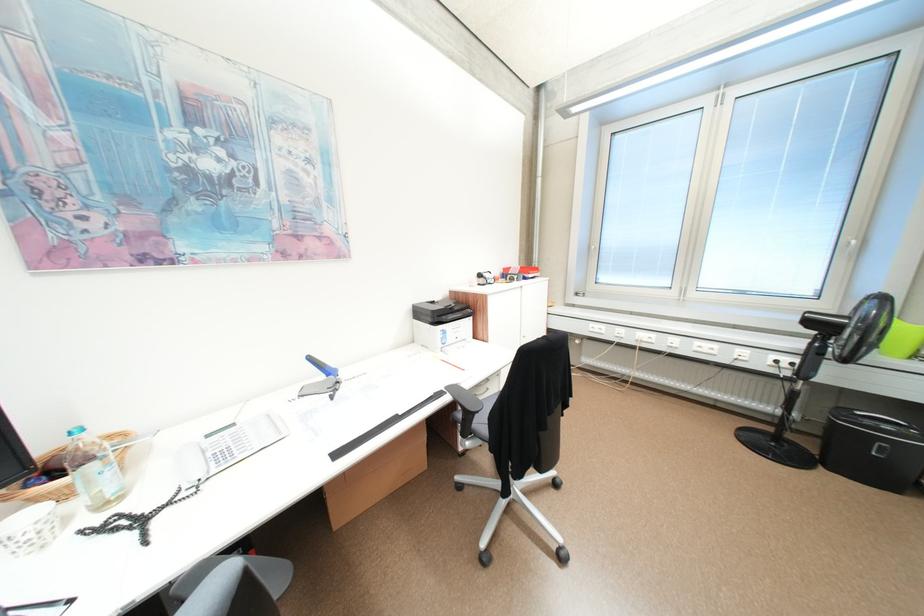
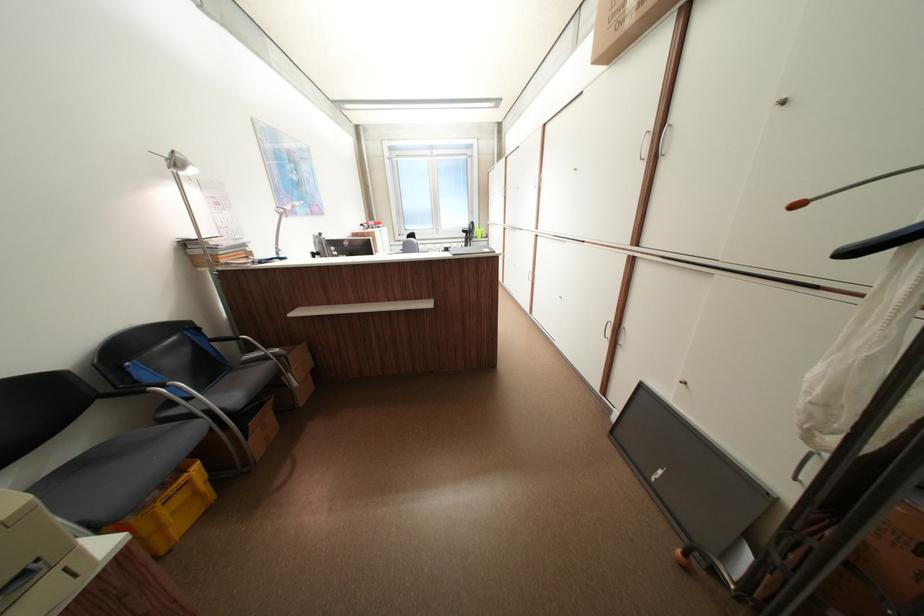
Question: I am providing you with two images of the same scene from different viewpoints. Please identify which objects are invisible in image2.

Choices:
 (A) patterned white cup
 (B) cardboard box
 (C) black wall eraser
 (D) silver chair armrest

Answer: (A)